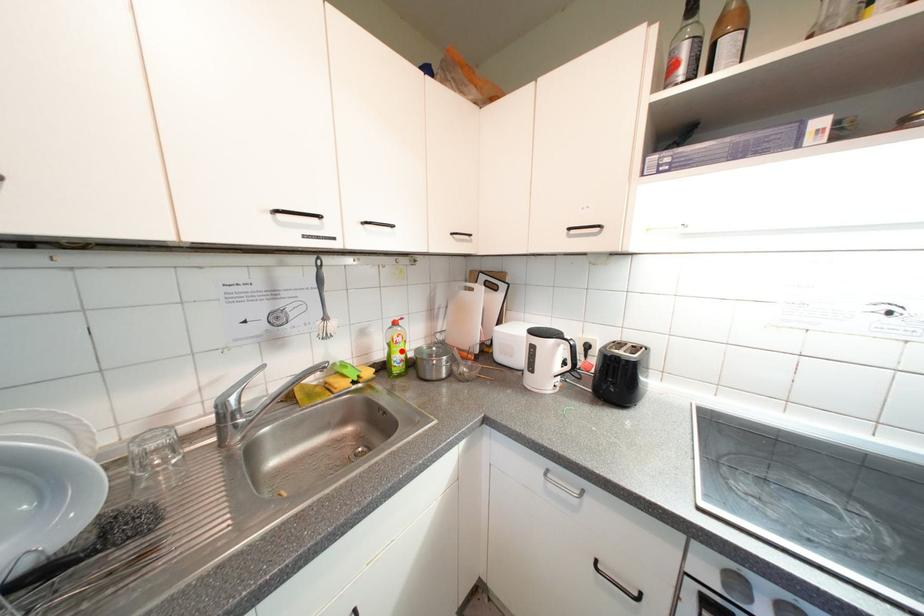
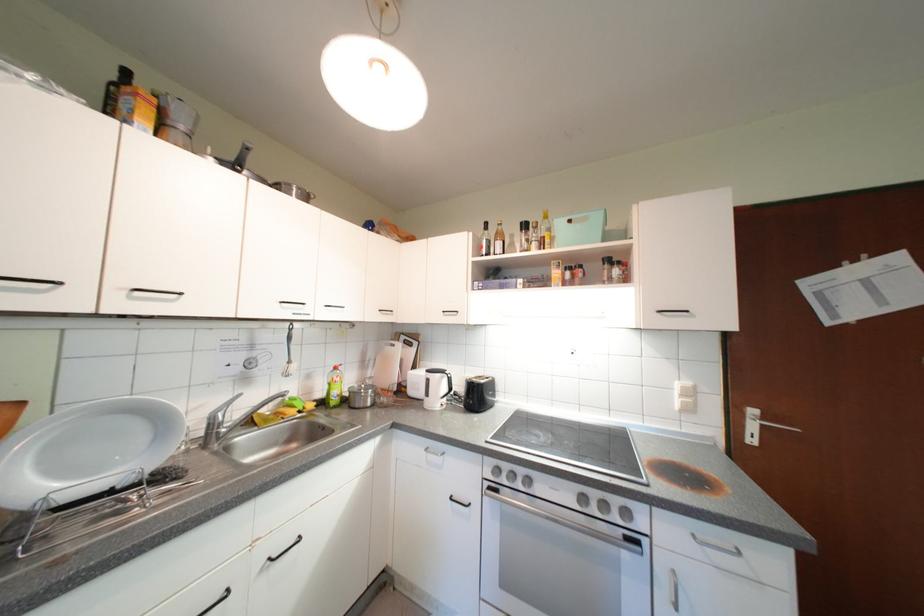
Locate, in the second image, the point that corresponds to the highlighted location in the first image.

(341, 389)